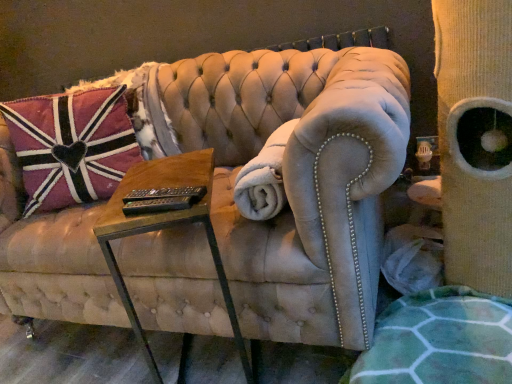
Question: Could you tell me if pink velvet pillow at left is facing suede couch at center?

Choices:
 (A) yes
 (B) no

Answer: (A)

Question: From a real-world perspective, is pink velvet pillow at left positioned under suede couch at center based on gravity?

Choices:
 (A) no
 (B) yes

Answer: (A)

Question: Is pink velvet pillow at left smaller than suede couch at center?

Choices:
 (A) yes
 (B) no

Answer: (A)

Question: Considering the relative sizes of pink velvet pillow at left and suede couch at center in the image provided, is pink velvet pillow at left bigger than suede couch at center?

Choices:
 (A) no
 (B) yes

Answer: (A)

Question: From a real-world perspective, does pink velvet pillow at left stand above suede couch at center?

Choices:
 (A) no
 (B) yes

Answer: (B)

Question: In the image, is pink velvet pillow at left positioned in front of or behind beige corduroy cat tree at right?

Choices:
 (A) front
 (B) behind

Answer: (B)

Question: Is pink velvet pillow at left inside the boundaries of beige corduroy cat tree at right, or outside?

Choices:
 (A) outside
 (B) inside

Answer: (A)

Question: In terms of width, does pink velvet pillow at left look wider or thinner when compared to beige corduroy cat tree at right?

Choices:
 (A) thin
 (B) wide

Answer: (A)

Question: From a real-world perspective, is pink velvet pillow at left physically located above or below beige corduroy cat tree at right?

Choices:
 (A) above
 (B) below

Answer: (A)

Question: Considering the relative positions of suede couch at center and woodenmaterial/texturetable at center in the image provided, is suede couch at center to the left or to the right of woodenmaterial/texturetable at center?

Choices:
 (A) right
 (B) left

Answer: (B)

Question: Considering the positions of point (353, 281) and point (211, 230), is point (353, 281) closer or farther from the camera than point (211, 230)?

Choices:
 (A) closer
 (B) farther

Answer: (B)

Question: Would you say suede couch at center is inside or outside woodenmaterial/texturetable at center?

Choices:
 (A) inside
 (B) outside

Answer: (B)

Question: Considering the positions of suede couch at center and woodenmaterial/texturetable at center in the image, is suede couch at center wider or thinner than woodenmaterial/texturetable at center?

Choices:
 (A) wide
 (B) thin

Answer: (A)

Question: Does point (263, 193) appear closer or farther from the camera than point (220, 122)?

Choices:
 (A) farther
 (B) closer

Answer: (B)

Question: Considering their positions, is white plush blanket at center located in front of or behind suede couch at center?

Choices:
 (A) front
 (B) behind

Answer: (B)